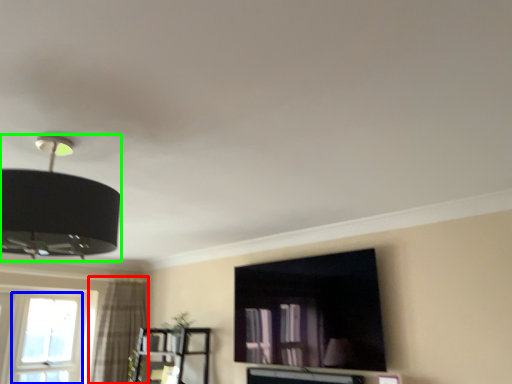
Question: Which is nearer to the curtain (highlighted by a red box)? window (highlighted by a blue box) or lamp (highlighted by a green box).

Choices:
 (A) window
 (B) lamp

Answer: (A)